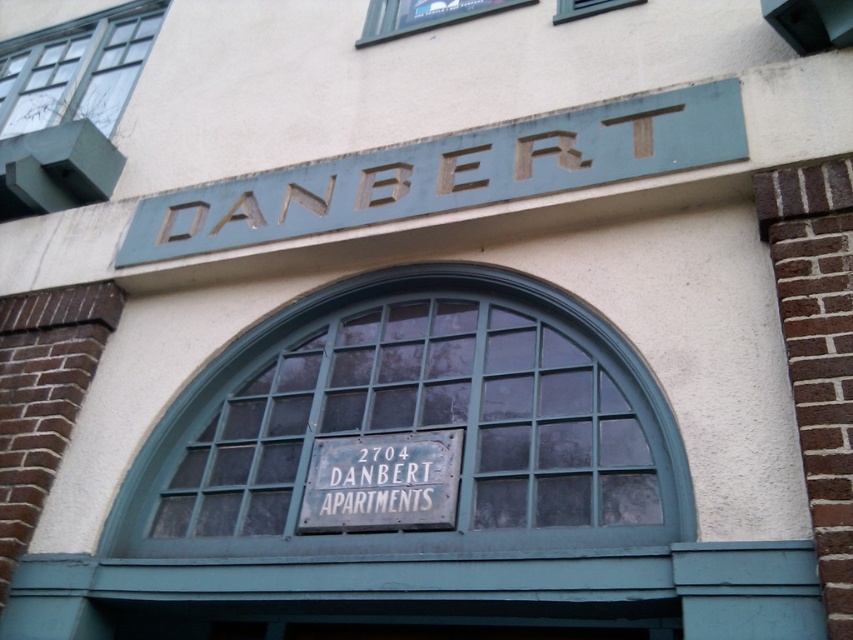
Is green painted metal sign at upper center shorter than white metal sign at center?

In fact, green painted metal sign at upper center may be taller than white metal sign at center.

Who is positioned more to the left, green painted metal sign at upper center or white metal sign at center?

Positioned to the left is white metal sign at center.

Between point (515, 176) and point (409, 493), which one is positioned in front?

Point (409, 493) is more forward.

You are a GUI agent. You are given a task and a screenshot of the screen. Output one action in this format:
    pyautogui.click(x=<x>, y=<y>)
    Task: Click on the green painted metal sign at upper center
    The image size is (853, 640).
    Given the screenshot: What is the action you would take?
    pyautogui.click(x=447, y=173)